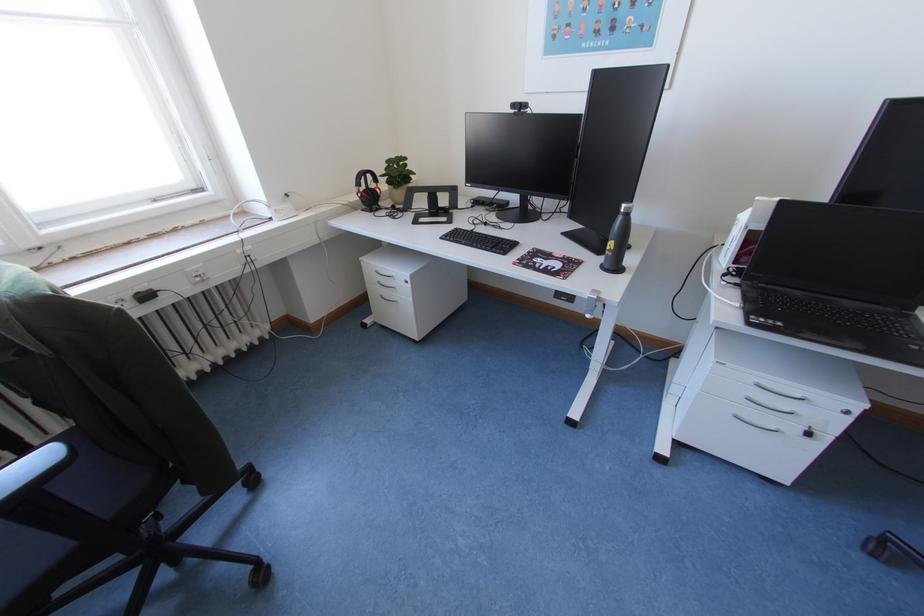
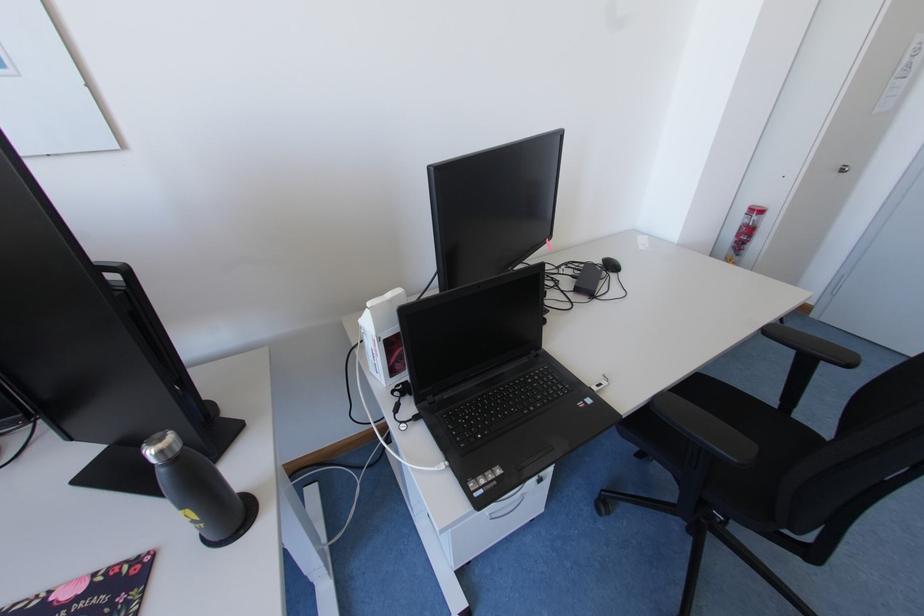
Question: The camera is either moving clockwise (left) or counter-clockwise (right) around the object. The first image is from the beginning of the video and the second image is from the end. Is the camera moving left or right when shooting the video?

Choices:
 (A) Left
 (B) Right

Answer: (A)